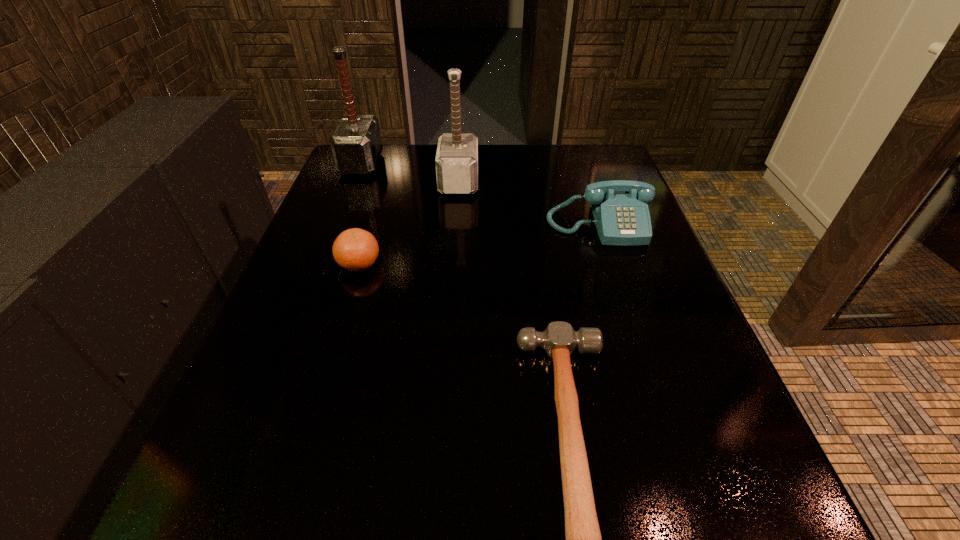
The width and height of the screenshot is (960, 540). I want to click on free space between the third farthest object and the clementine, so click(479, 244).

Find the location of `free point between the second nearest object and the leftmost hammer`. free point between the second nearest object and the leftmost hammer is located at coordinates (360, 214).

Identify the location of free space between the clementine and the second hammer from left to right. (409, 222).

At what (x,y) coordinates should I click in order to perform the action: click on empty space between the third object from right to left and the fourth farthest object. Please return your answer as a coordinate pair (x, y). The height and width of the screenshot is (540, 960). Looking at the image, I should click on (409, 222).

What are the coordinates of `vacant space in between the third farthest object and the second shortest object` in the screenshot? It's located at (479, 244).

Where is `free space that is in between the telephone and the fourth tallest object`? This screenshot has width=960, height=540. free space that is in between the telephone and the fourth tallest object is located at coordinates (479, 244).

Identify the location of free space that is in between the third shortest object and the second hammer from left to right. (529, 204).

What are the coordinates of `object that can be found as the third closest to the clementine` in the screenshot? It's located at (583, 538).

The width and height of the screenshot is (960, 540). In order to click on object that is the second closest to the rightmost hammer in this screenshot , I will do point(355,249).

This screenshot has width=960, height=540. Identify the location of hammer object that ranks as the second closest to the leftmost hammer. (583, 538).